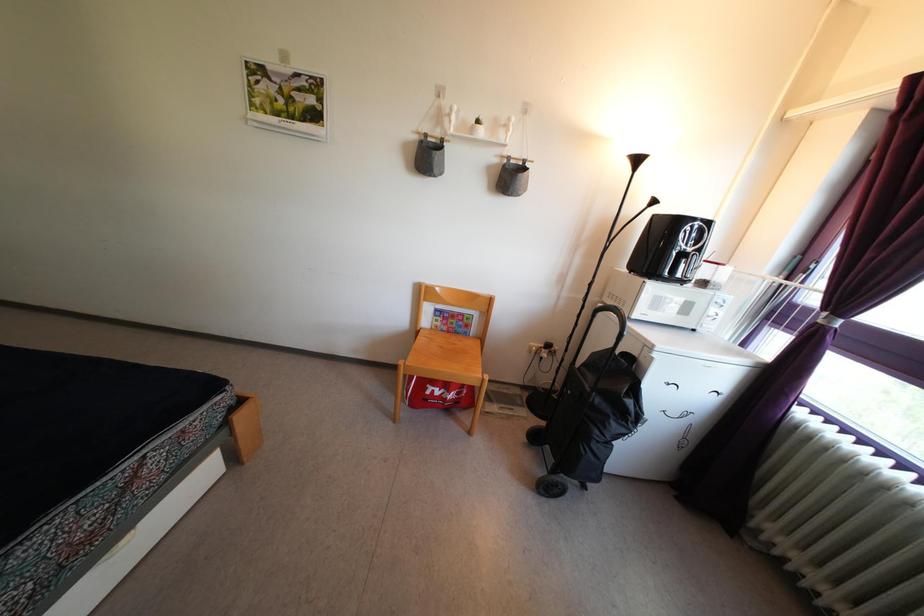
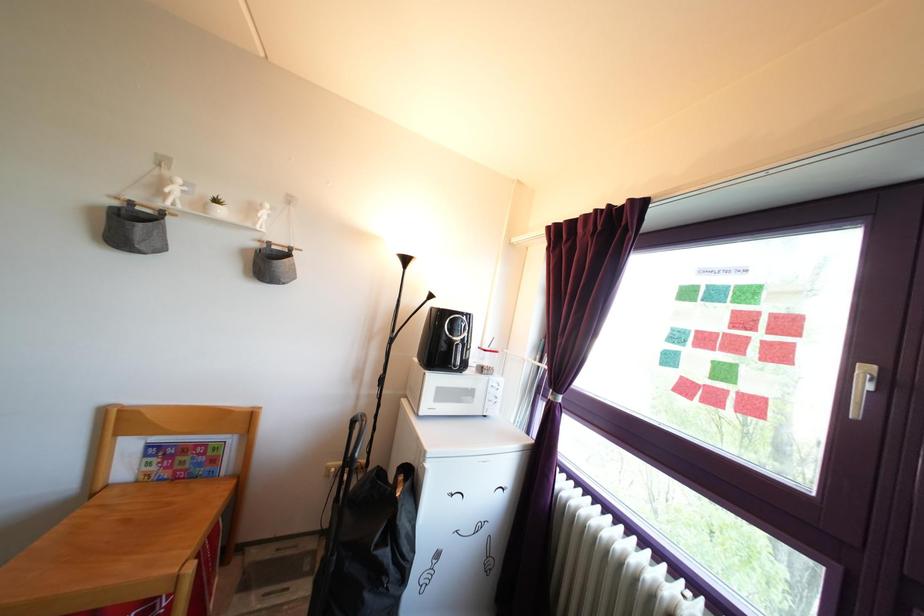
In the second image, find the point that corresponds to [447,337] in the first image.

(169, 483)